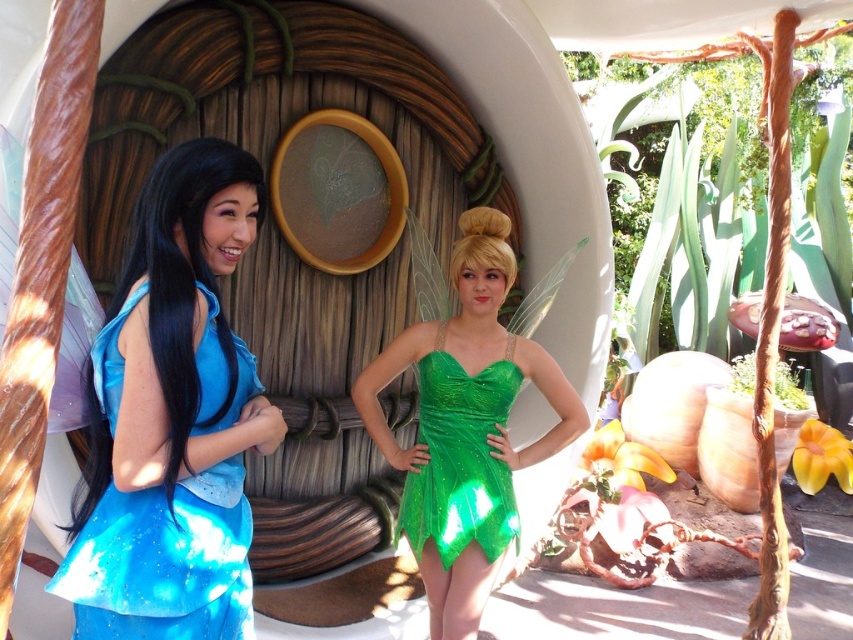
Question: Considering the real-world distances, which object is farthest from the green glittery dress at center?

Choices:
 (A) shiny blue dress at left
 (B) green sparkly dress at center

Answer: (A)

Question: Is shiny blue dress at left to the left of green glittery dress at center from the viewer's perspective?

Choices:
 (A) yes
 (B) no

Answer: (A)

Question: Which of the following is the farthest from the observer?

Choices:
 (A) shiny blue dress at left
 (B) green sparkly dress at center

Answer: (B)

Question: Is green sparkly dress at center further to the viewer compared to shiny blue dress at left?

Choices:
 (A) no
 (B) yes

Answer: (B)

Question: Which point is farther to the camera?

Choices:
 (A) green glittery dress at center
 (B) green sparkly dress at center
 (C) shiny blue dress at left

Answer: (B)

Question: Does green sparkly dress at center appear on the right side of shiny blue dress at left?

Choices:
 (A) no
 (B) yes

Answer: (B)